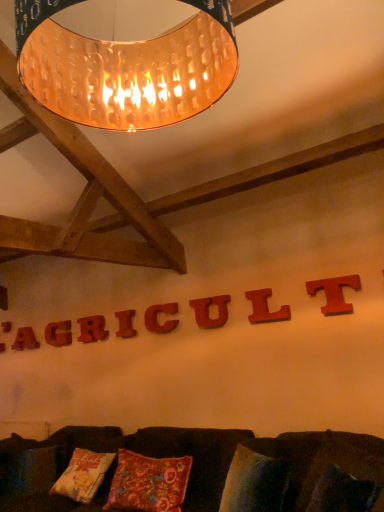
The image size is (384, 512). What are the coordinates of `red wood letter u at center, the sixth letter when ordered from left to right` in the screenshot? It's located at (208, 311).

Find the location of `wooden letter at center, the 2th letter when ordered from front to back`. wooden letter at center, the 2th letter when ordered from front to back is located at coordinates (265, 308).

In order to face velvet cushion at lower center, should I rotate leftwards or rightwards?

You should rotate left by 11.494 degrees.

Describe the element at coordinates (334, 293) in the screenshot. This screenshot has width=384, height=512. I see `matte red wooden t at upper center, which appears as the 1th letter when viewed from the front` at that location.

Find the location of `red wood letter u at center, the third letter when ordered from front to back`. red wood letter u at center, the third letter when ordered from front to back is located at coordinates (208, 311).

In the scene shown: Which object is wider, copper hammered lampshade at upper center or floral-patterned fabric pillow at center?

copper hammered lampshade at upper center is wider.

Relative to floral-patterned fabric pillow at center, is copper hammered lampshade at upper center in front or behind?

In the image, copper hammered lampshade at upper center appears in front of floral-patterned fabric pillow at center.

Is copper hammered lampshade at upper center positioned beyond the bounds of floral-patterned fabric pillow at center?

Yes, copper hammered lampshade at upper center is not within floral-patterned fabric pillow at center.

Is copper hammered lampshade at upper center positioned with its back to floral-patterned fabric pillow at center?

No, copper hammered lampshade at upper center is not facing the opposite direction of floral-patterned fabric pillow at center.

Which letter is the 1st one when counting from the left side of the velvet cushion at lower center? Please provide its 2D coordinates.

[(125, 324)]

Can you confirm if velvet cushion at lower center is shorter than wooden letter at center, the fourth letter from the back?

In fact, velvet cushion at lower center may be taller than wooden letter at center, the fourth letter from the back.

From the image's perspective, is velvet cushion at lower center on wooden letter at center, placed as the fifth letter when sorted from front to back?

No, from the image's perspective, velvet cushion at lower center is not over wooden letter at center, placed as the fifth letter when sorted from front to back.

Between matte red wooden t at upper center, which appears as the 1th letter when viewed from the front, and wooden letter at center, the fourth letter from the back, which one has more height?

matte red wooden t at upper center, which appears as the 1th letter when viewed from the front.

Consider the image. Considering the positions of objects matte red wooden t at upper center, the first letter in the right-to-left sequence, and wooden letter at center, placed as the fifth letter when sorted from front to back, in the image provided, who is more to the left, matte red wooden t at upper center, the first letter in the right-to-left sequence, or wooden letter at center, placed as the fifth letter when sorted from front to back,?

wooden letter at center, placed as the fifth letter when sorted from front to back.

Is matte red wooden t at upper center, the 8th letter viewed from the left, wider or thinner than wooden letter at center, placed as the fifth letter when sorted from front to back?

Considering their sizes, matte red wooden t at upper center, the 8th letter viewed from the left, looks slimmer than wooden letter at center, placed as the fifth letter when sorted from front to back.

Is wooden letter at center, the third letter positioned from the left, far from matte wooden letter at upper center, marked as the 2th letter in a left-to-right arrangement?

wooden letter at center, the third letter positioned from the left, is actually quite close to matte wooden letter at upper center, marked as the 2th letter in a left-to-right arrangement.

Which of these two, wooden letter at center, marked as the 6th letter in a right-to-left arrangement, or matte wooden letter at upper center, which is the seventh letter in front-to-back order, is bigger?

Bigger between the two is wooden letter at center, marked as the 6th letter in a right-to-left arrangement.

Where is `the 1st letter counting from the left side of the wooden letter at center, which is the 3th letter in back-to-front order`? the 1st letter counting from the left side of the wooden letter at center, which is the 3th letter in back-to-front order is located at coordinates (58, 333).

How many degrees apart are the facing directions of wooden letter at center, which is the 3th letter in back-to-front order, and matte wooden letter at upper center, which is the second letter in back-to-front order?

The angle between the facing direction of wooden letter at center, which is the 3th letter in back-to-front order, and the facing direction of matte wooden letter at upper center, which is the second letter in back-to-front order, is 0.00583 degrees.

Which of these two, wooden letter at center, the 4th letter viewed from the left, or wooden letter at center, the 2th letter when ordered from front to back, stands taller?

wooden letter at center, the 2th letter when ordered from front to back.

Is wooden letter at center, the 4th letter viewed from the left, situated inside wooden letter at center, which is the seventh letter in back-to-front order, or outside?

wooden letter at center, the 4th letter viewed from the left, is spatially situated outside wooden letter at center, which is the seventh letter in back-to-front order.

Consider the image. Is wooden letter at center, the 4th letter viewed from the left, to the left of wooden letter at center, positioned as the second letter in right-to-left order, from the viewer's perspective?

Correct, you'll find wooden letter at center, the 4th letter viewed from the left, to the left of wooden letter at center, positioned as the second letter in right-to-left order.

Is point (121, 316) positioned after point (264, 295)?

Yes, it is behind point (264, 295).

Would you say red wood letter u at center, marked as the third letter in a right-to-left arrangement, contains floral-patterned fabric pillow at center?

No, floral-patterned fabric pillow at center is located outside of red wood letter u at center, marked as the third letter in a right-to-left arrangement.

Considering the sizes of objects red wood letter u at center, marked as the third letter in a right-to-left arrangement, and floral-patterned fabric pillow at center in the image provided, who is thinner, red wood letter u at center, marked as the third letter in a right-to-left arrangement, or floral-patterned fabric pillow at center?

red wood letter u at center, marked as the third letter in a right-to-left arrangement.

Looking at this image, between red wood letter u at center, the third letter when ordered from front to back, and floral-patterned fabric pillow at center, which one has less height?

red wood letter u at center, the third letter when ordered from front to back.

Identify the location of pillow on the left of red wood letter u at center, marked as the third letter in a right-to-left arrangement. (149, 483).

Which is behind, point (202, 303) or point (48, 335)?

The point (48, 335) is behind.

Can you confirm if red wood letter u at center, the third letter when ordered from front to back, is bigger than matte wooden letter at upper center, which is the second letter in back-to-front order?

Actually, red wood letter u at center, the third letter when ordered from front to back, might be smaller than matte wooden letter at upper center, which is the second letter in back-to-front order.

Find the location of a particular element. letter that is the 1st one above the red wood letter u at center, marked as the third letter in a right-to-left arrangement (from a real-world perspective) is located at coordinates (58, 333).

Where is `lamp that appears in front of the floral-patterned fabric pillow at center`? Image resolution: width=384 pixels, height=512 pixels. lamp that appears in front of the floral-patterned fabric pillow at center is located at coordinates (126, 67).

Where is `the 5th letter behind the velvet cushion at lower center, counting from the anchor's position`? The height and width of the screenshot is (512, 384). the 5th letter behind the velvet cushion at lower center, counting from the anchor's position is located at coordinates (125, 324).

Based on their spatial positions, is wooden letter at center, placed as the fifth letter when sorted from front to back, or wooden letter at center, positioned as the second letter in right-to-left order, further from floral-patterned fabric pillow at center?

The object further to floral-patterned fabric pillow at center is wooden letter at center, placed as the fifth letter when sorted from front to back.

Estimate the real-world distances between objects in this image. Which object is closer to copper hammered lampshade at upper center, wooden letter at center, which is the seventh letter in back-to-front order, or wooden letter at upper center, the 1th letter when ordered from left to right?

wooden letter at center, which is the seventh letter in back-to-front order.

Based on the photo, which object lies nearer to the anchor point matte wooden letter at upper center, which is the seventh letter in front-to-back order, wooden letter at upper center, arranged as the eighth letter when viewed from the right, or copper hammered lampshade at upper center?

wooden letter at upper center, arranged as the eighth letter when viewed from the right.

Looking at the image, which one is located further to red wood letter u at center, marked as the third letter in a right-to-left arrangement, wooden letter at upper center, the 1th letter when ordered from left to right, or wooden letter at center, the fourth letter from the back?

Based on the image, wooden letter at upper center, the 1th letter when ordered from left to right, appears to be further to red wood letter u at center, marked as the third letter in a right-to-left arrangement.

Estimate the real-world distances between objects in this image. Which object is closer to matte red wooden t at upper center, the first letter in the right-to-left sequence, wooden letter at center, the 4th letter viewed from the left, or wooden letter at center, the 4th letter in the right-to-left sequence?

wooden letter at center, the 4th letter in the right-to-left sequence, lies closer to matte red wooden t at upper center, the first letter in the right-to-left sequence, than the other object.

Looking at the image, which one is located closer to matte wooden letter at upper center, which is the seventh letter in front-to-back order, copper hammered lampshade at upper center or red wood letter u at center, marked as the third letter in a right-to-left arrangement?

red wood letter u at center, marked as the third letter in a right-to-left arrangement, is closer to matte wooden letter at upper center, which is the seventh letter in front-to-back order.

Which object lies nearer to the anchor point matte red wooden t at upper center, which appears as the 1th letter when viewed from the front, velvet cushion at lower center or wooden letter at center, placed as the fifth letter when sorted from front to back?

Based on the image, velvet cushion at lower center appears to be nearer to matte red wooden t at upper center, which appears as the 1th letter when viewed from the front.

Based on their spatial positions, is wooden letter at center, which is the 5th letter in back-to-front order, or copper hammered lampshade at upper center closer to matte wooden letter at upper center, which is the seventh letter in front-to-back order?

wooden letter at center, which is the 5th letter in back-to-front order, lies closer to matte wooden letter at upper center, which is the seventh letter in front-to-back order, than the other object.

This screenshot has width=384, height=512. Identify the location of pillow situated between matte wooden letter at upper center, marked as the 2th letter in a left-to-right arrangement, and matte red wooden t at upper center, the eighth letter in the back-to-front sequence, from left to right. (149, 483).

This screenshot has height=512, width=384. Find the location of `pillow between copper hammered lampshade at upper center and red wood letter u at center, the sixth letter when ordered from left to right, from front to back`. pillow between copper hammered lampshade at upper center and red wood letter u at center, the sixth letter when ordered from left to right, from front to back is located at coordinates (149, 483).

Locate an element on the screen. pillow between copper hammered lampshade at upper center and wooden letter at center, which is the 5th letter in back-to-front order, from front to back is located at coordinates (149, 483).

At what (x,y) coordinates should I click in order to perform the action: click on pillow between velvet cushion at lower center and wooden letter at upper center, the 1th letter from the back, from front to back. Please return your answer as a coordinate pair (x, y). Looking at the image, I should click on (149, 483).